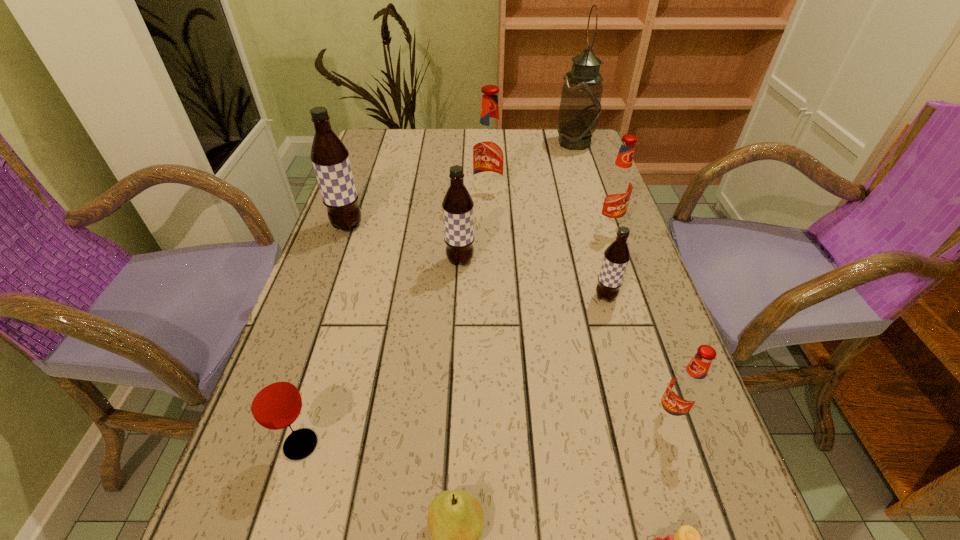
I want to click on the rightmost brown root beer, so click(617, 255).

Where is `the smallest red root beer`? The width and height of the screenshot is (960, 540). the smallest red root beer is located at coordinates (687, 387).

Where is `the nearest red root beer`? The height and width of the screenshot is (540, 960). the nearest red root beer is located at coordinates (687, 387).

Image resolution: width=960 pixels, height=540 pixels. Find the location of `glass`. glass is located at coordinates (275, 402).

Where is `free region located 0.380m on the left of the oil lamp`? This screenshot has height=540, width=960. free region located 0.380m on the left of the oil lamp is located at coordinates (438, 143).

The width and height of the screenshot is (960, 540). I want to click on blank space located on the back of the ninth nearest object, so pos(488,154).

The image size is (960, 540). I want to click on free space located 0.130m on the front of the leftmost brown root beer, so click(x=331, y=273).

This screenshot has height=540, width=960. What are the coordinates of `blank space located 0.160m on the left of the second smallest red root beer` in the screenshot? It's located at (532, 226).

At what (x,y) coordinates should I click in order to perform the action: click on free space located on the right of the fourth farthest root beer. Please return your answer as a coordinate pair (x, y). This screenshot has height=540, width=960. Looking at the image, I should click on (531, 261).

Find the location of a particular element. This screenshot has height=540, width=960. blank space located 0.370m on the back of the rightmost brown root beer is located at coordinates (576, 193).